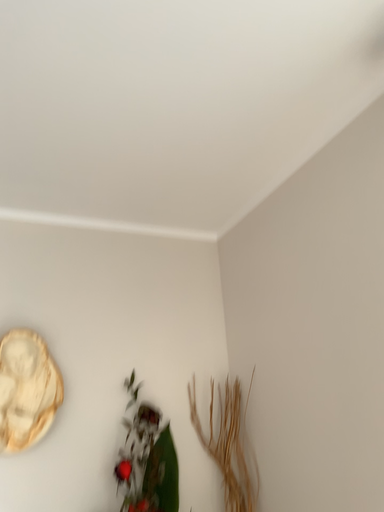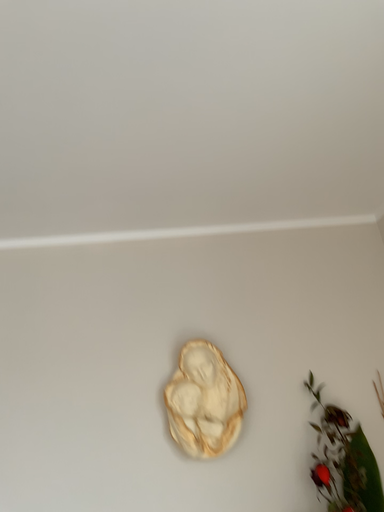
Question: Which way did the camera rotate in the video?

Choices:
 (A) rotated left
 (B) rotated right

Answer: (A)